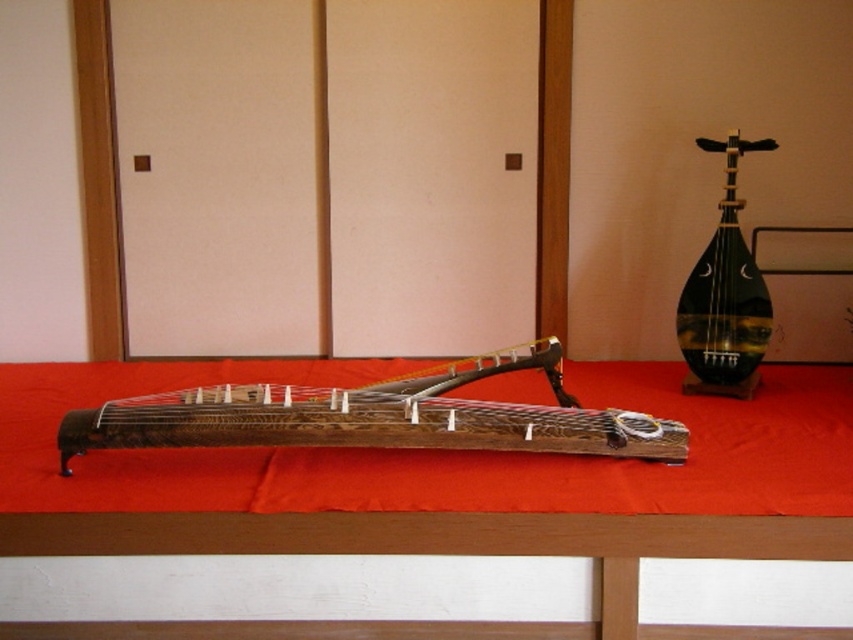
Question: Which of the following is the farthest from the observer?

Choices:
 (A) (717, 330)
 (B) (62, 419)

Answer: (A)

Question: Observing the image, what is the correct spatial positioning of wooden stringed instrument at center in reference to shiny dark green lute at right?

Choices:
 (A) right
 (B) left

Answer: (B)

Question: Can you confirm if wooden stringed instrument at center is thinner than shiny dark green lute at right?

Choices:
 (A) yes
 (B) no

Answer: (B)

Question: Is the position of wooden stringed instrument at center more distant than that of shiny dark green lute at right?

Choices:
 (A) no
 (B) yes

Answer: (A)